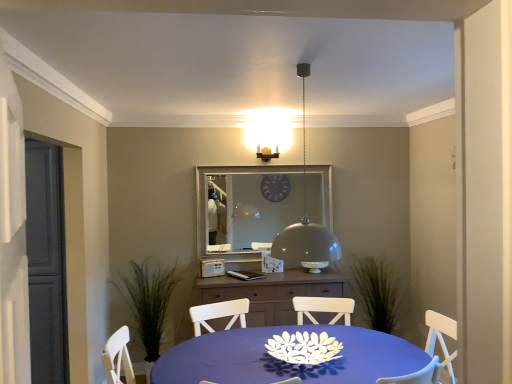
Where is `matte gray glass door at left`? Image resolution: width=512 pixels, height=384 pixels. matte gray glass door at left is located at coordinates (46, 263).

This screenshot has height=384, width=512. What do you see at coordinates (304, 348) in the screenshot?
I see `white paper flower at center` at bounding box center [304, 348].

The image size is (512, 384). Describe the element at coordinates (267, 153) in the screenshot. I see `matte brown pendant light at upper center` at that location.

Describe the element at coordinates (306, 224) in the screenshot. I see `matte gray dome at center` at that location.

Measure the distance between point (x=334, y=253) and camera.

The depth of point (x=334, y=253) is 2.29 meters.

This screenshot has width=512, height=384. What are the coordinates of `matte gray glass door at left` in the screenshot? It's located at (46, 263).

Relative to matte gray glass door at left, is white paper flower at center in front or behind?

white paper flower at center is in front of matte gray glass door at left.

Is point (298, 335) farther from viewer compared to point (63, 380)?

No, it is in front of (63, 380).

Is matte gray glass door at left inside white paper flower at center?

Actually, matte gray glass door at left is outside white paper flower at center.

Considering the sizes of objects white paper flower at center and matte gray glass door at left in the image provided, who is thinner, white paper flower at center or matte gray glass door at left?

matte gray glass door at left is thinner.

Which is more to the left, matte gray dome at center or silver metallic mirror at center?

silver metallic mirror at center is more to the left.

Does point (304, 235) come in front of point (225, 166)?

Yes, it is.

Would you consider matte gray dome at center to be distant from silver metallic mirror at center?

Yes, matte gray dome at center and silver metallic mirror at center are located far from each other.

Looking at their sizes, would you say matte gray dome at center is wider or thinner than silver metallic mirror at center?

Considering their sizes, matte gray dome at center looks broader than silver metallic mirror at center.

This screenshot has width=512, height=384. I want to click on flower above the matte brown cabinet at center (from the image's perspective), so click(304, 348).

Considering the positions of objects white paper flower at center and matte brown cabinet at center in the image provided, who is more to the left, white paper flower at center or matte brown cabinet at center?

From the viewer's perspective, matte brown cabinet at center appears more on the left side.

Does white paper flower at center come in front of matte brown cabinet at center?

Yes, it is in front of matte brown cabinet at center.

Is white paper flower at center positioned far away from matte brown cabinet at center?

white paper flower at center is far away from matte brown cabinet at center.

Considering the positions of objects blue fabric table at center and matte brown pendant light at upper center in the image provided, who is more to the right, blue fabric table at center or matte brown pendant light at upper center?

blue fabric table at center is more to the right.

Does blue fabric table at center touch matte brown pendant light at upper center?

blue fabric table at center is not next to matte brown pendant light at upper center, and they're not touching.

From their relative heights in the image, would you say blue fabric table at center is taller or shorter than matte brown pendant light at upper center?

blue fabric table at center is taller than matte brown pendant light at upper center.

Is blue fabric table at center looking in the opposite direction of matte brown pendant light at upper center?

No, blue fabric table at center is not facing away from matte brown pendant light at upper center.

Is green leafy plant at left completely or partially inside silver metallic mirror at center?

No, green leafy plant at left is not a part of silver metallic mirror at center.

Is silver metallic mirror at center next to green leafy plant at left and touching it?

No, silver metallic mirror at center is not with green leafy plant at left.

How distant is silver metallic mirror at center from green leafy plant at left?

silver metallic mirror at center is 24.88 inches away from green leafy plant at left.

This screenshot has height=384, width=512. Find the location of `plant on the left of silver metallic mirror at center`. plant on the left of silver metallic mirror at center is located at coordinates (149, 301).

Where is `flower below the silver metallic mirror at center (from a real-world perspective)`? The width and height of the screenshot is (512, 384). flower below the silver metallic mirror at center (from a real-world perspective) is located at coordinates (304, 348).

Is point (321, 353) closer to camera compared to point (272, 170)?

Yes.

Can we say white paper flower at center lies outside silver metallic mirror at center?

Indeed, white paper flower at center is completely outside silver metallic mirror at center.

From the image's perspective, is white paper flower at center located above or below silver metallic mirror at center?

Based on their image positions, white paper flower at center is located beneath silver metallic mirror at center.

How far apart are blue fabric table at center and white paper flower at center?

blue fabric table at center and white paper flower at center are 8.13 inches apart from each other.

Is blue fabric table at center shorter than white paper flower at center?

No.

Is blue fabric table at center wider or thinner than white paper flower at center?

Clearly, blue fabric table at center has more width compared to white paper flower at center.

Which of these two, blue fabric table at center or white paper flower at center, is bigger?

With larger size is blue fabric table at center.

The height and width of the screenshot is (384, 512). What are the coordinates of `flower to the right of matte gray glass door at left` in the screenshot? It's located at click(304, 348).

The image size is (512, 384). In order to click on lamp above the silver metallic mirror at center (from a real-world perspective) in this screenshot , I will do `click(306, 224)`.

Which object lies further to the anchor point blue fabric table at center, matte brown pendant light at upper center or matte gray glass door at left?

Based on the image, matte brown pendant light at upper center appears to be further to blue fabric table at center.

Estimate the real-world distances between objects in this image. Which object is further from matte brown pendant light at upper center, silver metallic mirror at center or blue fabric table at center?

blue fabric table at center is further to matte brown pendant light at upper center.

When comparing their distances from silver metallic mirror at center, does blue fabric table at center or matte brown cabinet at center seem further?

blue fabric table at center is positioned further to the anchor silver metallic mirror at center.

Looking at the image, which one is located further to matte gray glass door at left, silver metallic mirror at center or blue fabric table at center?

blue fabric table at center lies further to matte gray glass door at left than the other object.

Which object lies nearer to the anchor point green leafy plant at left, matte gray dome at center or matte gray glass door at left?

matte gray glass door at left is closer to green leafy plant at left.

Consider the image. When comparing their distances from matte brown pendant light at upper center, does white paper flower at center or matte brown cabinet at center seem closer?

matte brown cabinet at center.

Based on their spatial positions, is green leafy plant at left or matte gray dome at center closer to white paper flower at center?

The object closer to white paper flower at center is matte gray dome at center.

Based on the photo, from the image, which object appears to be farther from silver metallic mirror at center, matte gray dome at center or blue fabric table at center?

The object further to silver metallic mirror at center is blue fabric table at center.

The height and width of the screenshot is (384, 512). Identify the location of mirror between white paper flower at center and matte brown pendant light at upper center from front to back. (230, 175).

This screenshot has width=512, height=384. I want to click on plant between white paper flower at center and matte brown pendant light at upper center along the z-axis, so click(x=149, y=301).

The width and height of the screenshot is (512, 384). Identify the location of mirror between matte gray dome at center and matte brown pendant light at upper center from front to back. click(230, 175).

The width and height of the screenshot is (512, 384). I want to click on lamp between white paper flower at center and green leafy plant at left along the z-axis, so click(x=306, y=224).